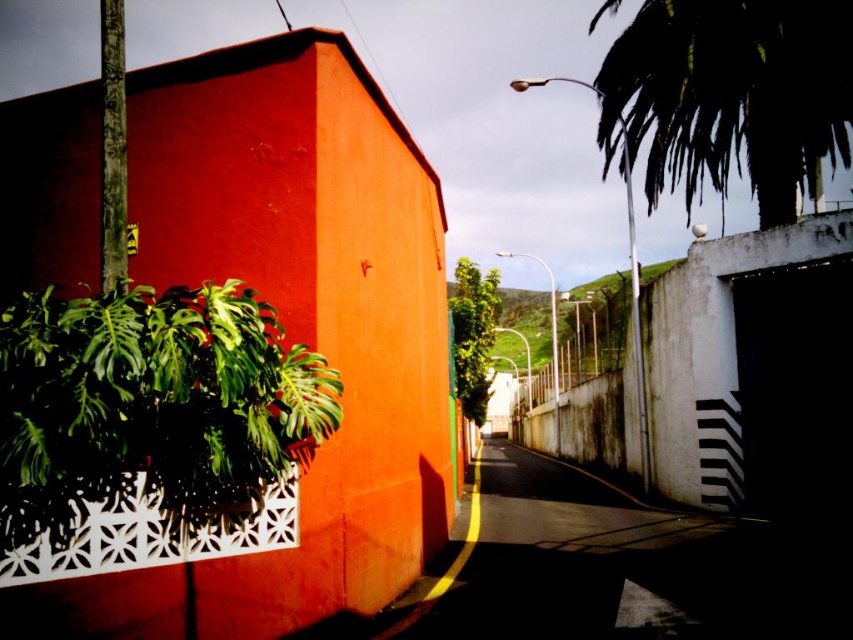
Does green leafy plant at left appear over dark asphalt at center?

Yes, green leafy plant at left is above dark asphalt at center.

Is point (189, 358) behind point (483, 493)?

That is False.

Where is `green leafy plant at left`? The image size is (853, 640). green leafy plant at left is located at coordinates (151, 404).